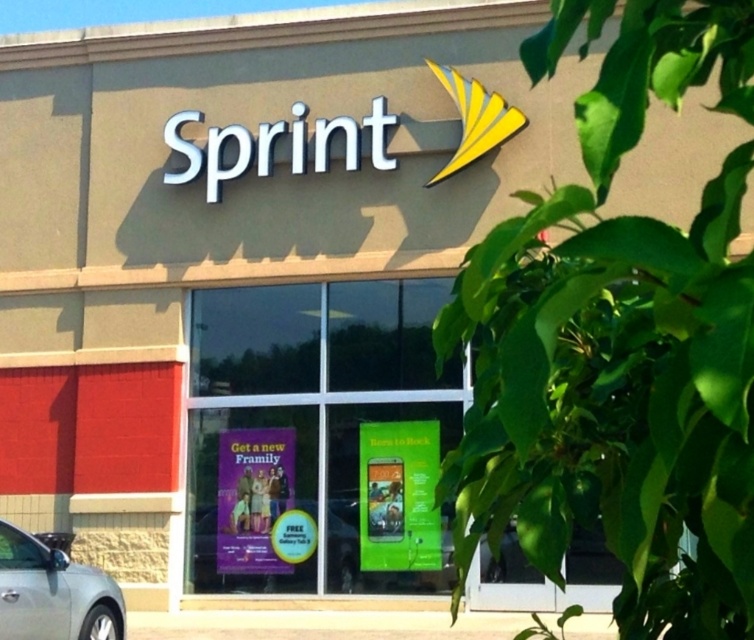
Question: Is green matte phone at center to the right of silver metallic car at lower left from the viewer's perspective?

Choices:
 (A) yes
 (B) no

Answer: (A)

Question: Which of the following is the closest to the observer?

Choices:
 (A) (377, 490)
 (B) (222, 476)
 (C) (103, 632)

Answer: (C)

Question: Can you confirm if silver metallic car at lower left is wider than purple glossy poster at lower center?

Choices:
 (A) no
 (B) yes

Answer: (A)

Question: Is green matte phone at center wider than purple glossy poster at lower center?

Choices:
 (A) yes
 (B) no

Answer: (B)

Question: Among these objects, which one is farthest from the camera?

Choices:
 (A) silver metallic car at lower left
 (B) green matte phone at center
 (C) purple glossy poster at lower center

Answer: (C)

Question: Which point is closer to the camera taking this photo?

Choices:
 (A) (37, 540)
 (B) (428, 544)

Answer: (A)